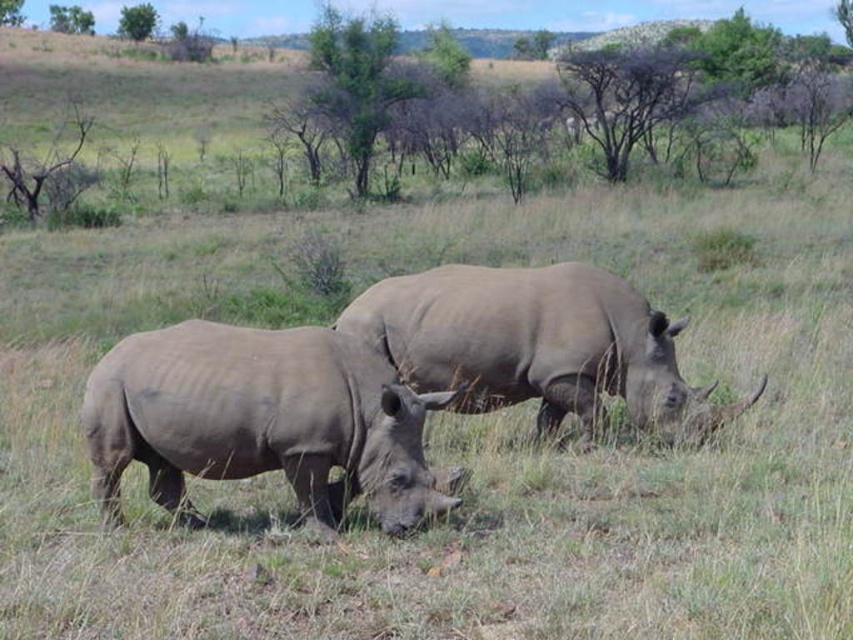
Between gray matte rhinoceros at lower left and gray matte rhinoceros at center, which one is positioned lower?

gray matte rhinoceros at lower left

Which of these two, gray matte rhinoceros at lower left or gray matte rhinoceros at center, stands shorter?

gray matte rhinoceros at lower left is shorter.

Identify the location of gray matte rhinoceros at lower left. (260, 420).